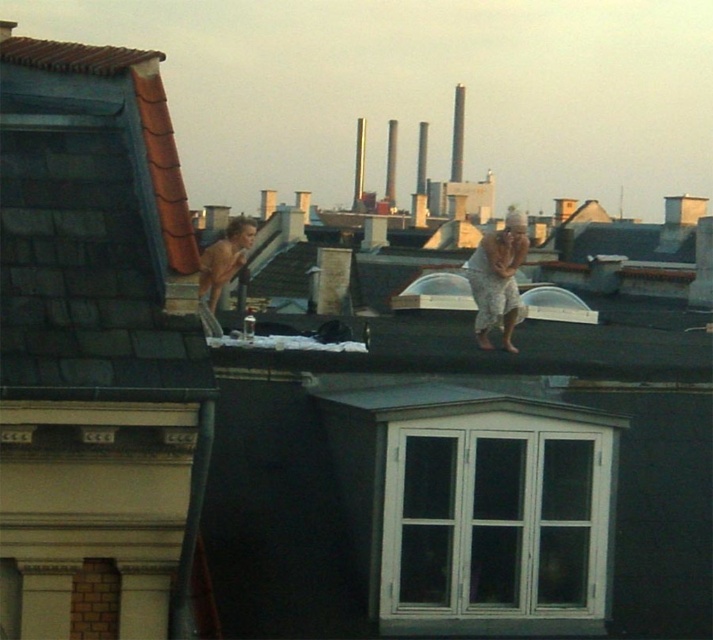
Question: Which of the following is the farthest from the observer?

Choices:
 (A) shiny skin at center
 (B) gray textured pants at center

Answer: (B)

Question: Which point is farther to the camera?

Choices:
 (A) gray textured pants at center
 (B) shiny skin at center

Answer: (A)

Question: Can you confirm if gray textured pants at center is smaller than shiny skin at center?

Choices:
 (A) no
 (B) yes

Answer: (B)

Question: Is gray textured pants at center positioned behind shiny skin at center?

Choices:
 (A) no
 (B) yes

Answer: (B)

Question: Does gray textured pants at center have a lesser width compared to shiny skin at center?

Choices:
 (A) yes
 (B) no

Answer: (A)